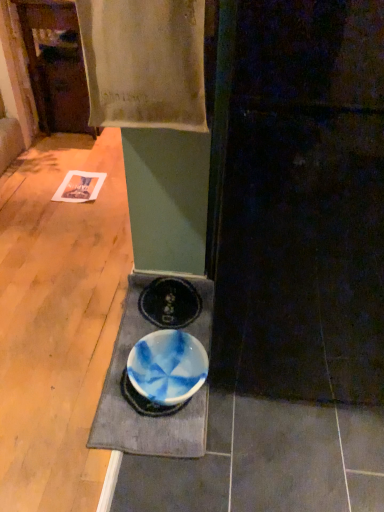
The height and width of the screenshot is (512, 384). What are the coordinates of `free spot in front of blue glossy bowl at center` in the screenshot? It's located at (152, 473).